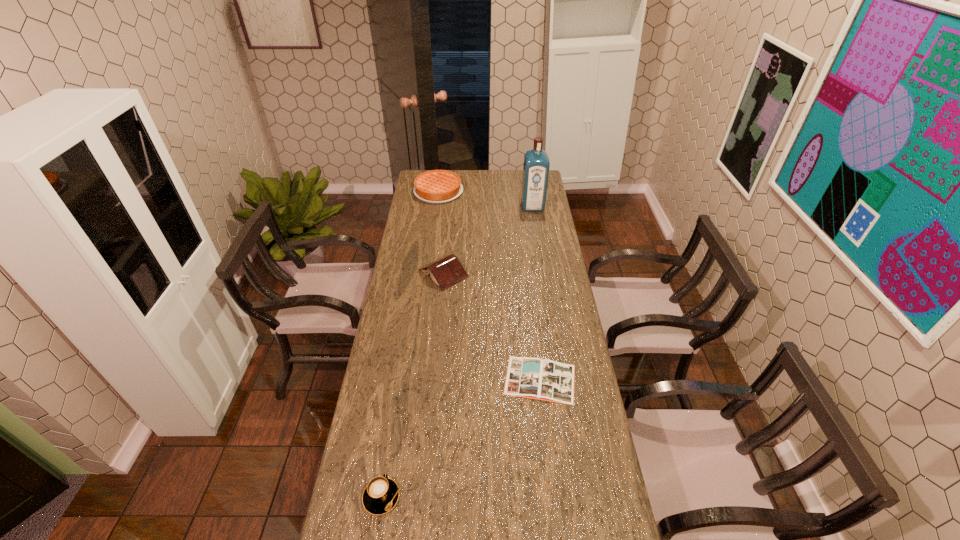
The image size is (960, 540). What are the coordinates of `free space that satisfies the following two spatial constraints: 1. on the front side of the farthest book; 2. on the left side of the second farthest book` in the screenshot? It's located at (434, 380).